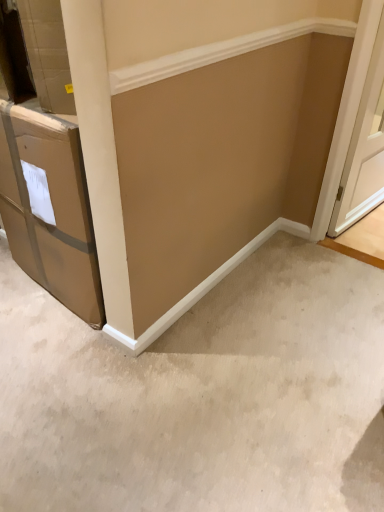
Question: Is beige carpet at lower center not within white wood door at right?

Choices:
 (A) yes
 (B) no

Answer: (A)

Question: Does beige carpet at lower center have a lesser height compared to white wood door at right?

Choices:
 (A) no
 (B) yes

Answer: (B)

Question: Would you say beige carpet at lower center is a long distance from white wood door at right?

Choices:
 (A) no
 (B) yes

Answer: (B)

Question: Considering the relative positions of beige carpet at lower center and white wood door at right in the image provided, is beige carpet at lower center behind white wood door at right?

Choices:
 (A) yes
 (B) no

Answer: (B)

Question: Considering the relative sizes of beige carpet at lower center and white wood door at right in the image provided, is beige carpet at lower center bigger than white wood door at right?

Choices:
 (A) yes
 (B) no

Answer: (B)

Question: Is beige carpet at lower center surrounding white wood door at right?

Choices:
 (A) no
 (B) yes

Answer: (A)

Question: Is the depth of white wood door at right less than that of beige carpet at lower center?

Choices:
 (A) yes
 (B) no

Answer: (B)

Question: Can we say white wood door at right lies outside beige carpet at lower center?

Choices:
 (A) yes
 (B) no

Answer: (A)

Question: From the image's perspective, would you say white wood door at right is shown under beige carpet at lower center?

Choices:
 (A) no
 (B) yes

Answer: (A)

Question: Could you tell me if white wood door at right is facing beige carpet at lower center?

Choices:
 (A) no
 (B) yes

Answer: (A)

Question: Is white wood door at right to the right of beige carpet at lower center from the viewer's perspective?

Choices:
 (A) no
 (B) yes

Answer: (B)

Question: Does white wood door at right have a lesser width compared to beige carpet at lower center?

Choices:
 (A) no
 (B) yes

Answer: (B)

Question: From a real-world perspective, is beige carpet at lower center positioned above or below white wood door at right?

Choices:
 (A) below
 (B) above

Answer: (A)